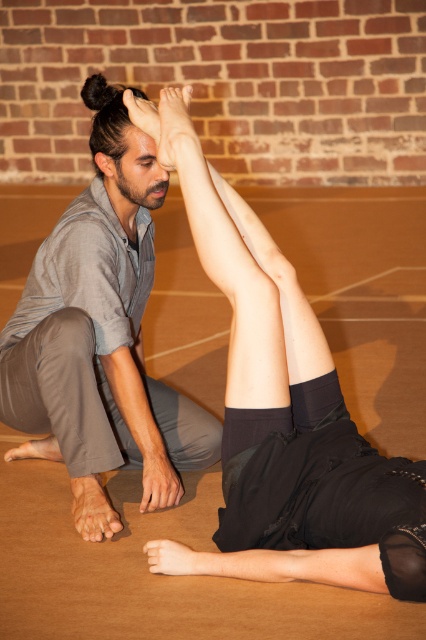
Is point (253, 493) positioned in front of point (120, 200)?

Yes, it is.

Between point (241, 561) and point (135, 321), which one is positioned behind?

The point (135, 321) is behind.

Locate an element on the screen. This screenshot has height=640, width=426. smooth skin leg at center is located at coordinates (284, 412).